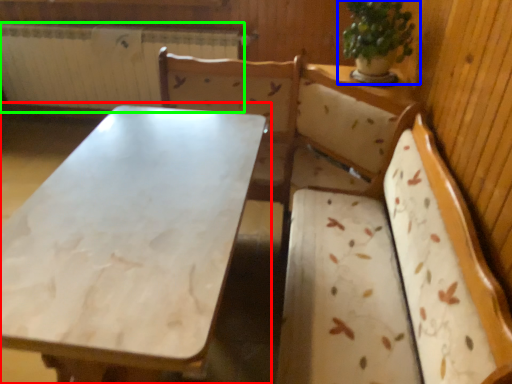
Question: Considering the real-world distances, which object is farthest from table (highlighted by a red box)? houseplant (highlighted by a blue box) or radiator (highlighted by a green box)?

Choices:
 (A) houseplant
 (B) radiator

Answer: (B)